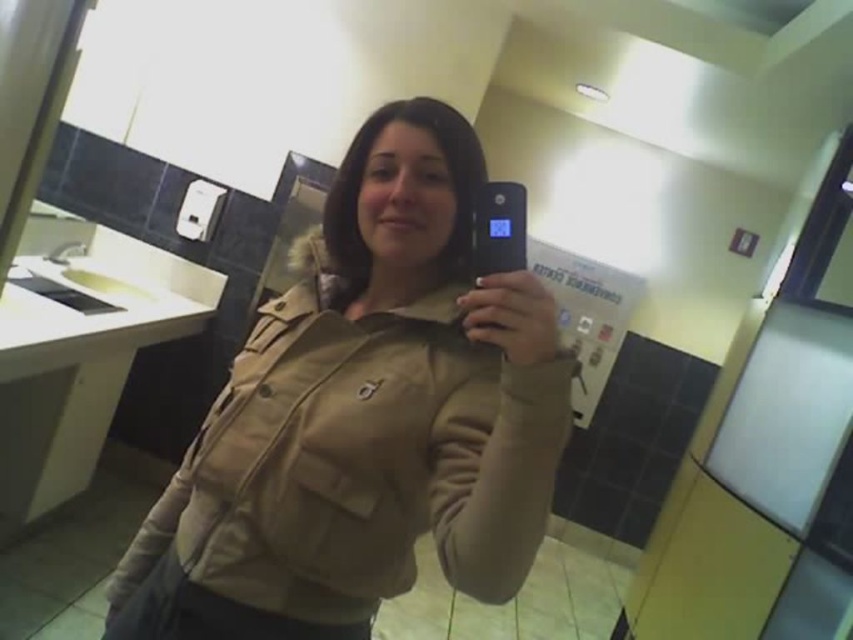
Question: Among these objects, which one is farthest from the camera?

Choices:
 (A) white glossy sink at left
 (B) matte khaki jacket at center
 (C) black plastic phone at center

Answer: (A)

Question: Which is farther from the white glossy sink at left?

Choices:
 (A) black plastic phone at center
 (B) matte khaki jacket at center

Answer: (A)

Question: Which point is farther from the camera taking this photo?

Choices:
 (A) (490, 227)
 (B) (309, 600)

Answer: (B)

Question: Is white glossy sink at left above black plastic phone at center?

Choices:
 (A) no
 (B) yes

Answer: (A)

Question: Is matte khaki jacket at center further to the viewer compared to black plastic phone at center?

Choices:
 (A) no
 (B) yes

Answer: (A)

Question: Is white glossy sink at left wider than black plastic phone at center?

Choices:
 (A) no
 (B) yes

Answer: (B)